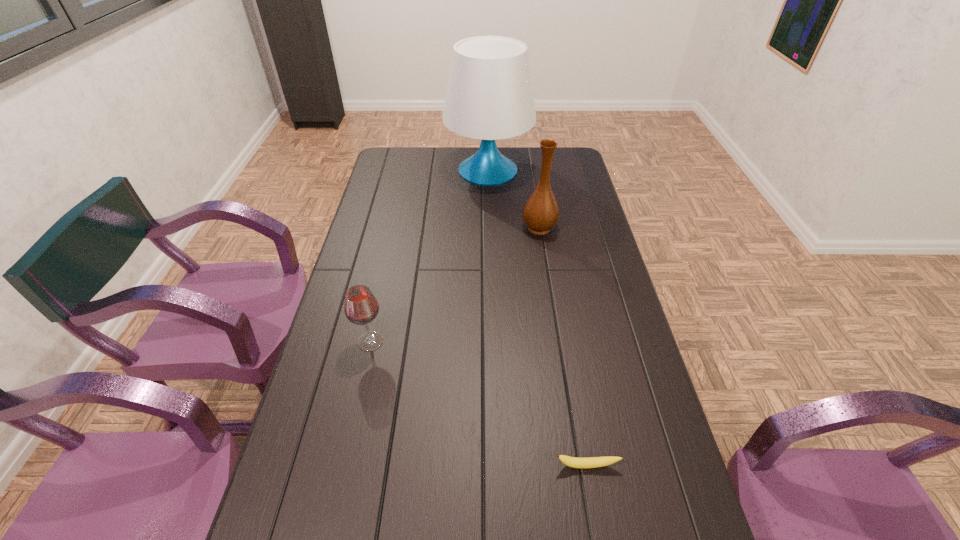
Where is `vacant space located on the back of the second nearest object`? Image resolution: width=960 pixels, height=540 pixels. vacant space located on the back of the second nearest object is located at coordinates (393, 244).

This screenshot has width=960, height=540. In order to click on free space located 0.070m on the upward curve of the nearest object in this screenshot , I will do pos(593,504).

At what (x,y) coordinates should I click in order to perform the action: click on object located at the far edge. Please return your answer as a coordinate pair (x, y). Looking at the image, I should click on (489, 96).

Find the location of a particular element. The width and height of the screenshot is (960, 540). object positioned at the left edge is located at coordinates (361, 307).

I want to click on vase at the right edge, so click(540, 213).

Where is `banana at the right edge`? This screenshot has height=540, width=960. banana at the right edge is located at coordinates (592, 462).

Where is `vacant space at the far edge of the desktop`? The height and width of the screenshot is (540, 960). vacant space at the far edge of the desktop is located at coordinates (447, 149).

The width and height of the screenshot is (960, 540). In the image, there is a desktop. Find the location of `free space at the left edge`. free space at the left edge is located at coordinates (324, 413).

Where is `vacant area at the right edge`? Image resolution: width=960 pixels, height=540 pixels. vacant area at the right edge is located at coordinates (641, 417).

This screenshot has height=540, width=960. What are the coordinates of `free space at the far left corner of the desktop` in the screenshot? It's located at (389, 157).